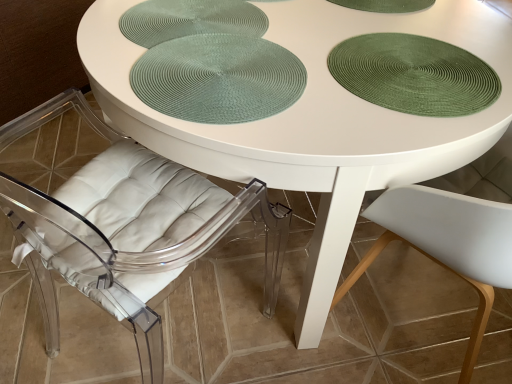
Where is `empty space that is to the right of green woven placemat at upper center, which ranks as the first glass plate in left-to-right order`? This screenshot has width=512, height=384. empty space that is to the right of green woven placemat at upper center, which ranks as the first glass plate in left-to-right order is located at coordinates (323, 37).